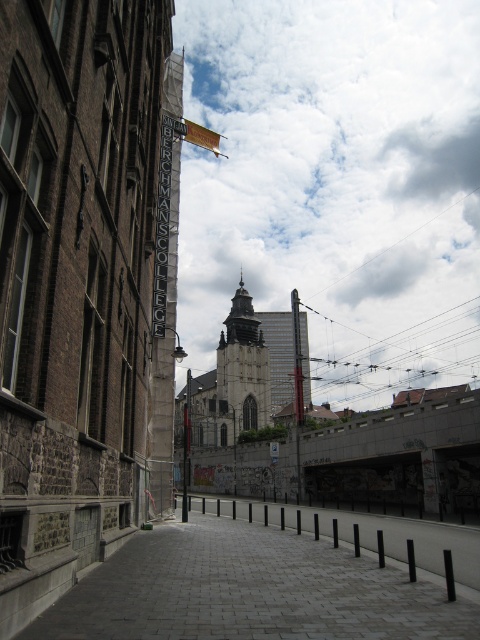
Does gray cobblestone pavement at center have a lesser height compared to silver metallic sign at center?

Yes.

How much distance is there between gray cobblestone pavement at center and silver metallic sign at center?

15.98 meters

The image size is (480, 640). What do you see at coordinates (249, 589) in the screenshot? I see `gray cobblestone pavement at center` at bounding box center [249, 589].

Where is `gray cobblestone pavement at center`? The width and height of the screenshot is (480, 640). gray cobblestone pavement at center is located at coordinates (249, 589).

Can you confirm if cloudy sky at upper center is bigger than silver metallic sign at center?

Yes.

Who is more forward, (181, 326) or (169, 284)?

Positioned in front is point (169, 284).

The image size is (480, 640). Find the location of `cloudy sky at upper center`. cloudy sky at upper center is located at coordinates (336, 186).

Locate an element on the screen. This screenshot has width=480, height=640. cloudy sky at upper center is located at coordinates (336, 186).

Does cloudy sky at upper center have a lesser width compared to gray cobblestone pavement at center?

No.

Is cloudy sky at upper center to the right of gray cobblestone pavement at center from the viewer's perspective?

Correct, you'll find cloudy sky at upper center to the right of gray cobblestone pavement at center.

Does point (285, 294) lie in front of point (369, 588)?

No.

Locate an element on the screen. cloudy sky at upper center is located at coordinates (336, 186).